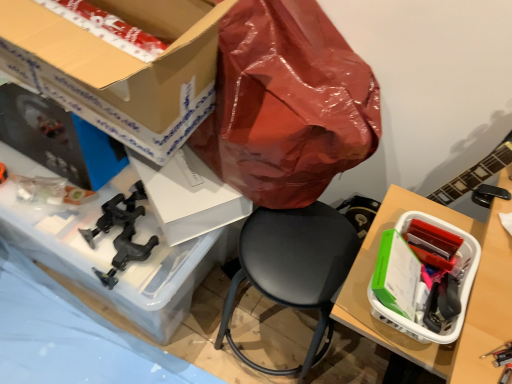
You are a GUI agent. You are given a task and a screenshot of the screen. Output one action in this format:
    pyautogui.click(x=<x>, y=<y>)
    Task: Click on the vacant area situated below black leather chair at center (from a real-world perspective)
    The height and width of the screenshot is (384, 512).
    Given the screenshot: What is the action you would take?
    pyautogui.click(x=274, y=325)